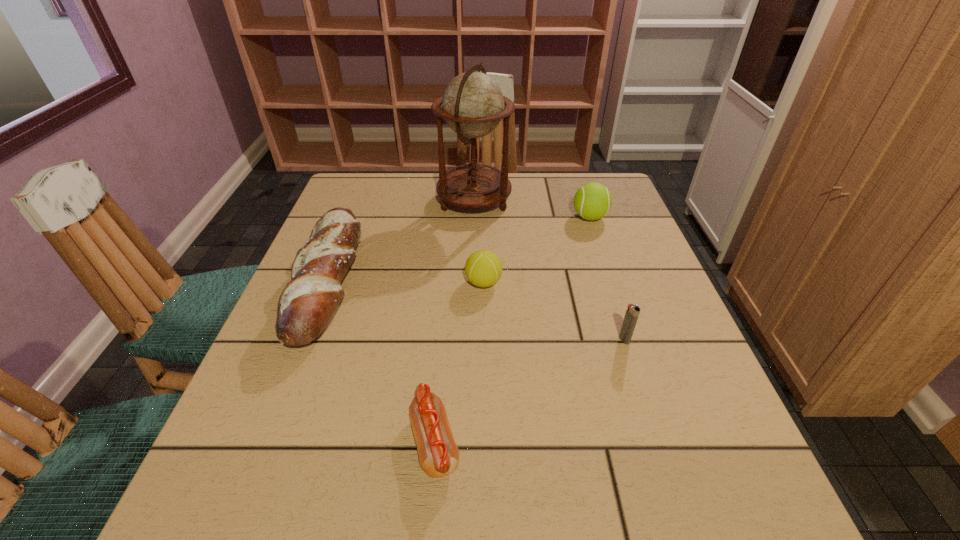
Where is `igniter located in the right edge section of the desktop`? This screenshot has width=960, height=540. igniter located in the right edge section of the desktop is located at coordinates (632, 313).

In order to click on object present at the far right corner in this screenshot , I will do `click(592, 201)`.

This screenshot has width=960, height=540. In the image, there is a desktop. In order to click on vacant space at the far edge in this screenshot , I will do `click(405, 191)`.

Image resolution: width=960 pixels, height=540 pixels. I want to click on free point at the near edge, so click(x=625, y=502).

Where is `free location at the left edge of the desktop`? free location at the left edge of the desktop is located at coordinates (x=295, y=475).

I want to click on vacant space at the right edge of the desktop, so click(672, 335).

Locate an element on the screen. free space at the far right corner of the desktop is located at coordinates (614, 188).

This screenshot has width=960, height=540. Identify the location of vacant space at the near right corner. (689, 534).

Where is `free space that is in between the sausage and the shorter tennis ball`? Image resolution: width=960 pixels, height=540 pixels. free space that is in between the sausage and the shorter tennis ball is located at coordinates (459, 362).

This screenshot has width=960, height=540. I want to click on empty location between the shorter tennis ball and the leftmost object, so [x=406, y=282].